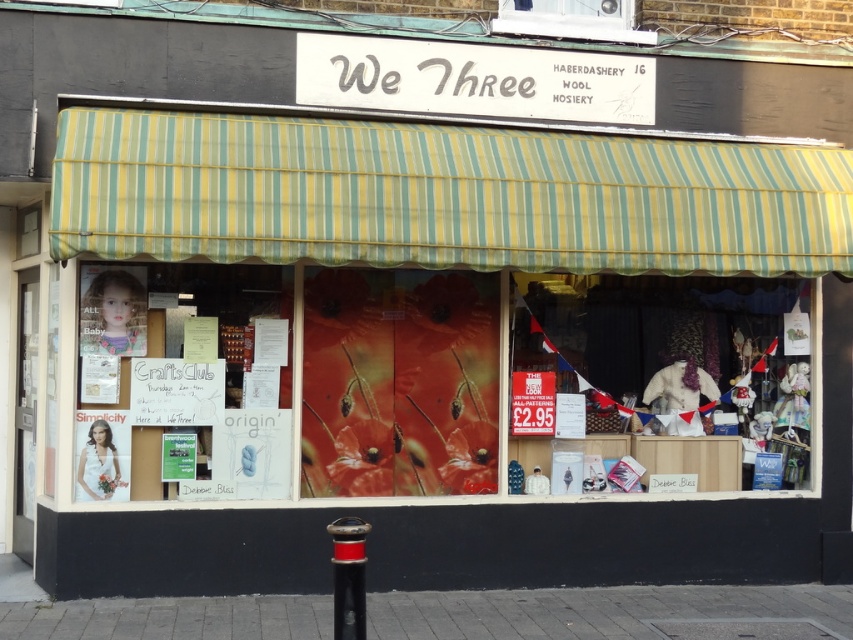
This screenshot has width=853, height=640. What do you see at coordinates (677, 358) in the screenshot? I see `matte white dress at center` at bounding box center [677, 358].

Is matte white dress at center shorter than transparent plastic window at upper center?

No.

The height and width of the screenshot is (640, 853). Describe the element at coordinates (677, 358) in the screenshot. I see `matte white dress at center` at that location.

The image size is (853, 640). I want to click on matte white dress at center, so click(677, 358).

Between point (613, 296) and point (355, 534), which one is positioned behind?

Positioned behind is point (613, 296).

This screenshot has height=640, width=853. What do you see at coordinates (677, 358) in the screenshot?
I see `matte white dress at center` at bounding box center [677, 358].

Measure the distance between matte white dress at center and camera.

28.24 feet

What are the coordinates of `matte white dress at center` in the screenshot? It's located at (677, 358).

Who is positioned more to the right, transparent plastic window at upper center or black plastic pole at lower center?

Positioned to the right is transparent plastic window at upper center.

Describe the element at coordinates (572, 19) in the screenshot. This screenshot has height=640, width=853. I see `transparent plastic window at upper center` at that location.

Where is `transparent plastic window at upper center`? transparent plastic window at upper center is located at coordinates (572, 19).